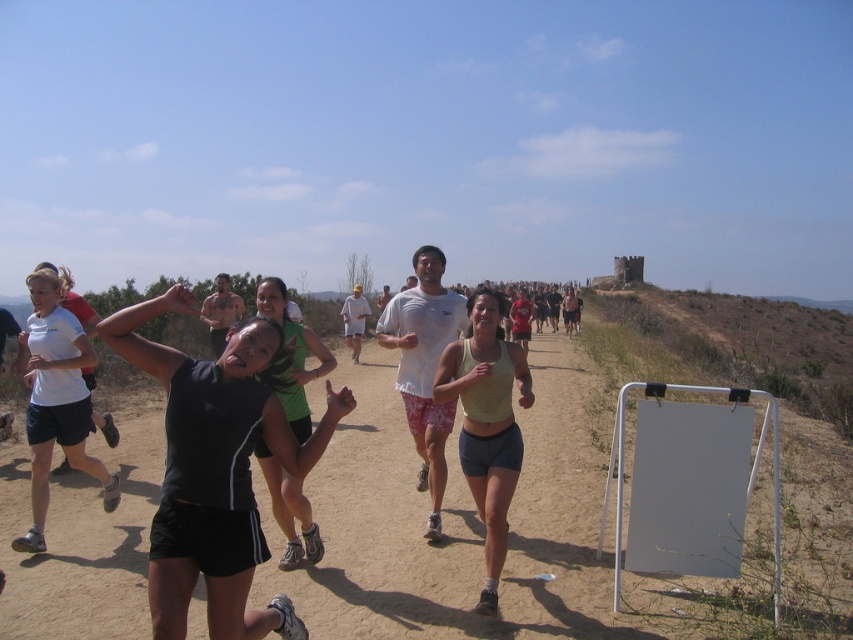
Question: Does white matte tank top at center appear on the left side of black athletic shorts at center?

Choices:
 (A) no
 (B) yes

Answer: (B)

Question: Which object appears farthest from the camera in this image?

Choices:
 (A) white matte tank top at center
 (B) light green tank top at center
 (C) black athletic shorts at center

Answer: (A)

Question: Is light green tank top at center to the right of white matte tank top at center from the viewer's perspective?

Choices:
 (A) yes
 (B) no

Answer: (A)

Question: Among these points, which one is farthest from the camera?

Choices:
 (A) (167, 502)
 (B) (505, 458)
 (C) (71, 417)

Answer: (C)

Question: Can you confirm if black fabric tank top at center is wider than black athletic shorts at center?

Choices:
 (A) no
 (B) yes

Answer: (B)

Question: Which point is closer to the camera taking this photo?

Choices:
 (A) (57, 273)
 (B) (262, 467)
 (C) (490, 595)

Answer: (C)